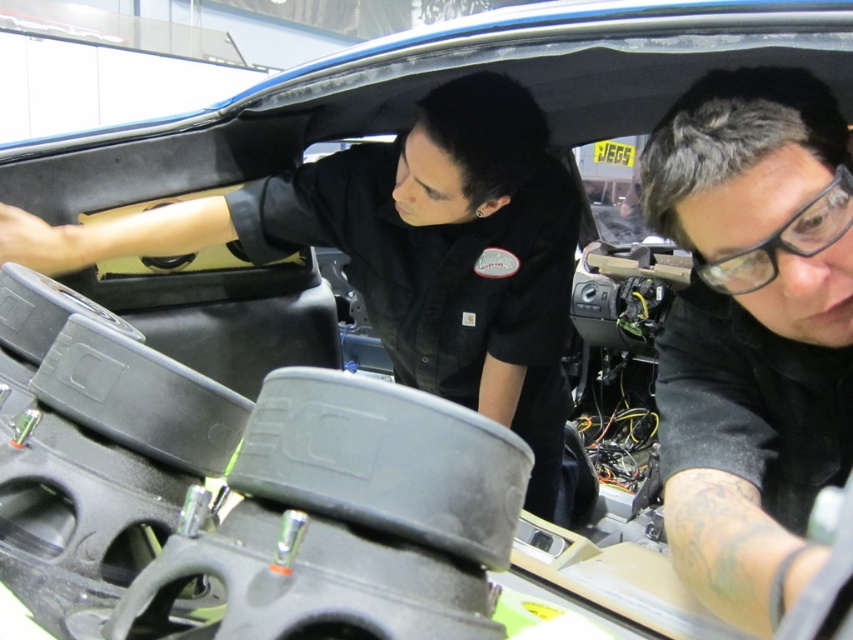
Looking at this image, who is lower down, black matte shirt at center or black matte shirt at upper center?

black matte shirt at upper center is lower down.

Is black matte shirt at center taller than black matte shirt at upper center?

In fact, black matte shirt at center may be shorter than black matte shirt at upper center.

The height and width of the screenshot is (640, 853). Identify the location of black matte shirt at center. (752, 332).

At what (x,y) coordinates should I click in order to perform the action: click on black matte shirt at center. Please return your answer as a coordinate pair (x, y). Looking at the image, I should click on (752, 332).